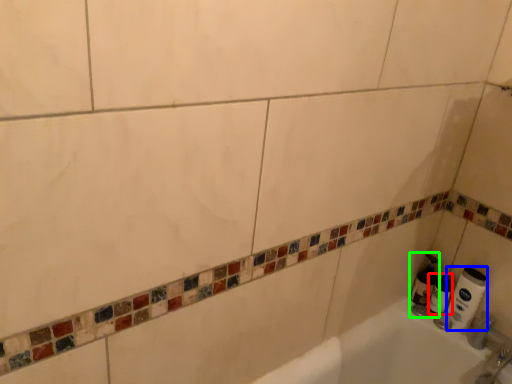
Question: Which object is the closest to the toilet paper (highlighted by a red box)? Choose among these: toilet paper (highlighted by a blue box) or soap dispenser (highlighted by a green box).

Choices:
 (A) toilet paper
 (B) soap dispenser

Answer: (B)